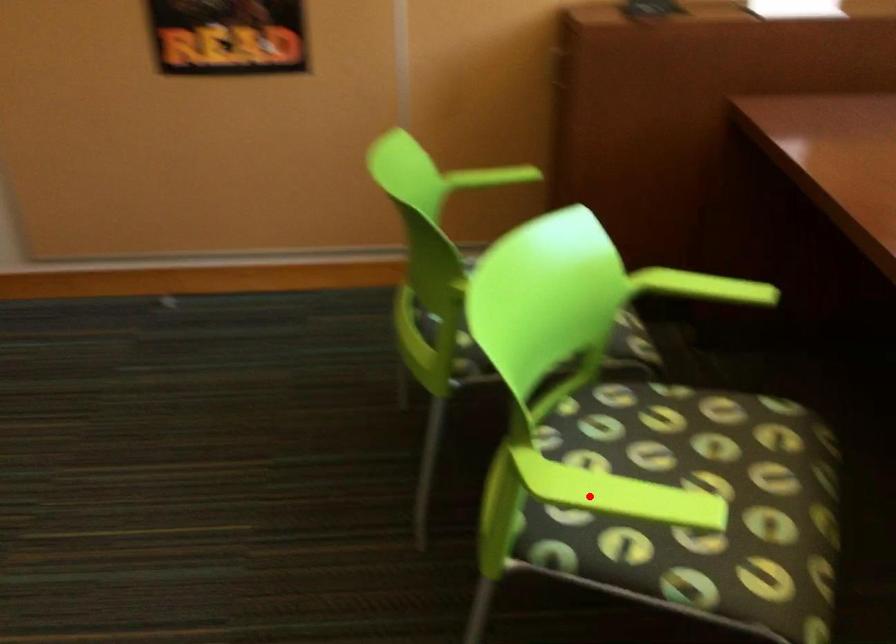
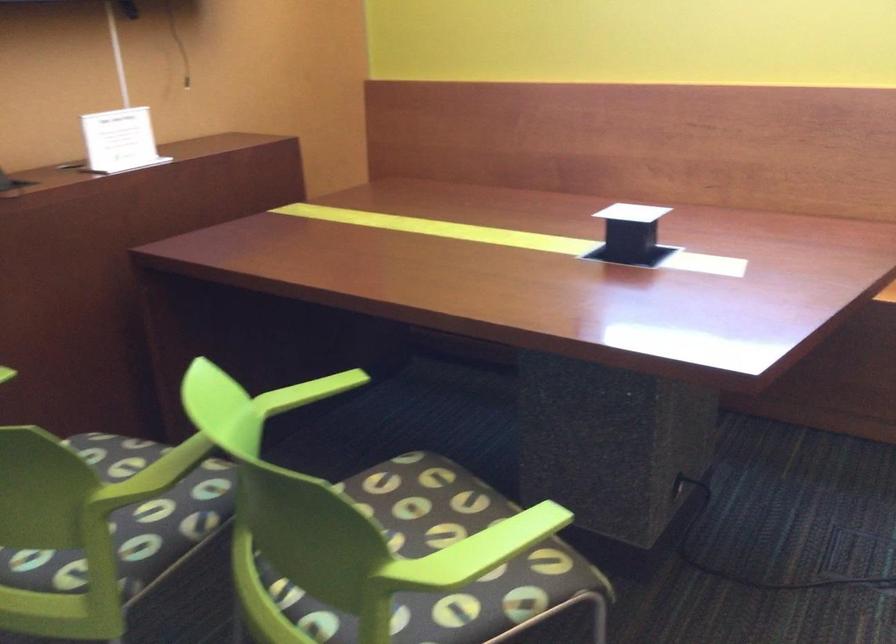
Question: A red point is marked in image1. In image2, is the corresponding 3D point closer to the camera or farther? Reply with the corresponding letter.

Choices:
 (A) The corresponding 3D point is closer.
 (B) The corresponding 3D point is farther.

Answer: (B)